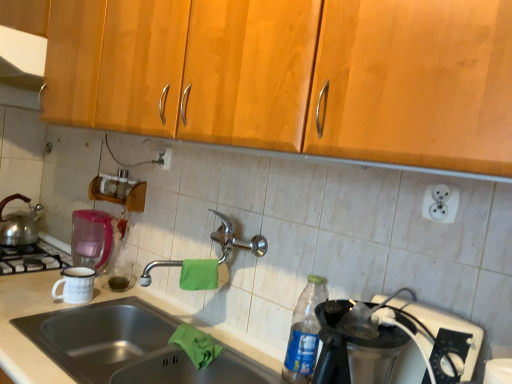
Question: Is white enamel mug at left at the back of white plastic outlet at upper right, which appears as the 2th electric outlet when viewed from the left?

Choices:
 (A) no
 (B) yes

Answer: (A)

Question: Can white enamel mug at left be found inside white plastic outlet at upper right, which appears as the 2th electric outlet when viewed from the left?

Choices:
 (A) no
 (B) yes

Answer: (A)

Question: Is white plastic outlet at upper right, acting as the 2th electric outlet starting from the top, positioned beyond the bounds of white enamel mug at left?

Choices:
 (A) yes
 (B) no

Answer: (A)

Question: Is white plastic outlet at upper right, which appears as the 2th electric outlet when viewed from the left, with white enamel mug at left?

Choices:
 (A) no
 (B) yes

Answer: (A)

Question: Is white plastic outlet at upper right, which is the first electric outlet from right to left, not close to white enamel mug at left?

Choices:
 (A) yes
 (B) no

Answer: (A)

Question: Is white plastic electric outlet at upper center, which appears as the second electric outlet when viewed from the right, spatially inside pink plastic coffee machine at left, or outside of it?

Choices:
 (A) outside
 (B) inside

Answer: (A)

Question: From the image's perspective, is white plastic electric outlet at upper center, placed as the first electric outlet when sorted from left to right, located above or below pink plastic coffee machine at left?

Choices:
 (A) below
 (B) above

Answer: (B)

Question: Based on their positions, is white plastic electric outlet at upper center, the second electric outlet in the bottom-to-top sequence, located to the left or right of pink plastic coffee machine at left?

Choices:
 (A) left
 (B) right

Answer: (B)

Question: Relative to pink plastic coffee machine at left, is white plastic electric outlet at upper center, arranged as the 1th electric outlet when viewed from the top, in front or behind?

Choices:
 (A) front
 (B) behind

Answer: (A)

Question: Is point (431, 195) closer or farther from the camera than point (128, 357)?

Choices:
 (A) farther
 (B) closer

Answer: (B)

Question: In terms of width, does white plastic outlet at upper right, placed as the first electric outlet when sorted from front to back, look wider or thinner when compared to stainless steel sink at lower left?

Choices:
 (A) thin
 (B) wide

Answer: (A)

Question: From the image's perspective, is white plastic outlet at upper right, placed as the first electric outlet when sorted from front to back, located above or below stainless steel sink at lower left?

Choices:
 (A) below
 (B) above

Answer: (B)

Question: Considering the relative positions of white plastic outlet at upper right, the first electric outlet in the bottom-to-top sequence, and stainless steel sink at lower left in the image provided, is white plastic outlet at upper right, the first electric outlet in the bottom-to-top sequence, to the left or to the right of stainless steel sink at lower left?

Choices:
 (A) right
 (B) left

Answer: (A)

Question: Based on their positions, is white enamel mug at left located to the left or right of green cloth at sink, which ranks as the second material in top-to-bottom order?

Choices:
 (A) left
 (B) right

Answer: (A)

Question: Is white enamel mug at left in front of or behind green cloth at sink, which ranks as the second material in top-to-bottom order, in the image?

Choices:
 (A) behind
 (B) front

Answer: (A)